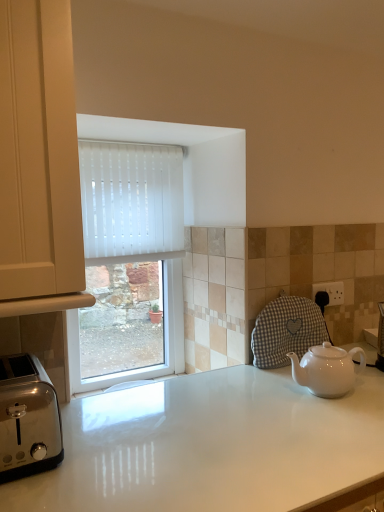
Locate an element on the screen. vacant space to the left of white ceramic teapot at lower right is located at coordinates (263, 392).